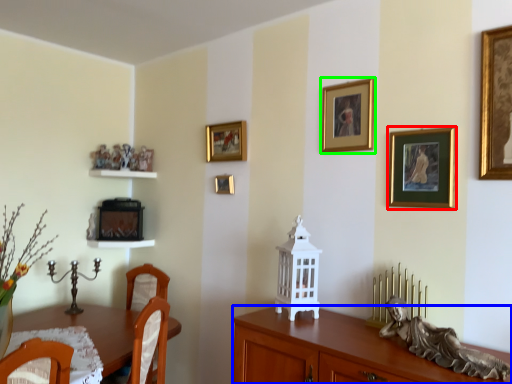
Question: Based on their relative distances, which object is nearer to picture frame (highlighted by a red box)? Choose from cabinetry (highlighted by a blue box) and picture frame (highlighted by a green box).

Choices:
 (A) cabinetry
 (B) picture frame

Answer: (B)